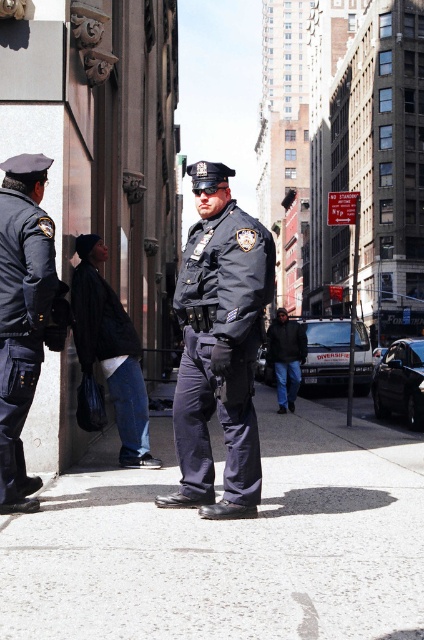
Question: Can you confirm if black matte jacket at lower left is positioned to the right of dark blue jeans at center?

Choices:
 (A) yes
 (B) no

Answer: (B)

Question: Which point is closer to the camera?

Choices:
 (A) (286, 342)
 (B) (215, 474)
 (C) (242, 429)
 (D) (141, 440)

Answer: (C)

Question: In this image, where is dark blue uniform at center located relative to dark blue jeans at center?

Choices:
 (A) above
 (B) below

Answer: (A)

Question: Among these points, which one is farthest from the camera?

Choices:
 (A) (195, 355)
 (B) (136, 355)
 (C) (78, 573)
 (D) (300, 356)

Answer: (D)

Question: In this image, where is black matte jacket at lower left located relative to dark blue jeans at center?

Choices:
 (A) above
 (B) below

Answer: (A)

Question: Which of these objects is positioned farthest from the dark blue jeans at center?

Choices:
 (A) black matte jacket at lower left
 (B) dark blue uniform at center
 (C) matte black uniform at left
 (D) gray concrete sidewalk at center

Answer: (C)